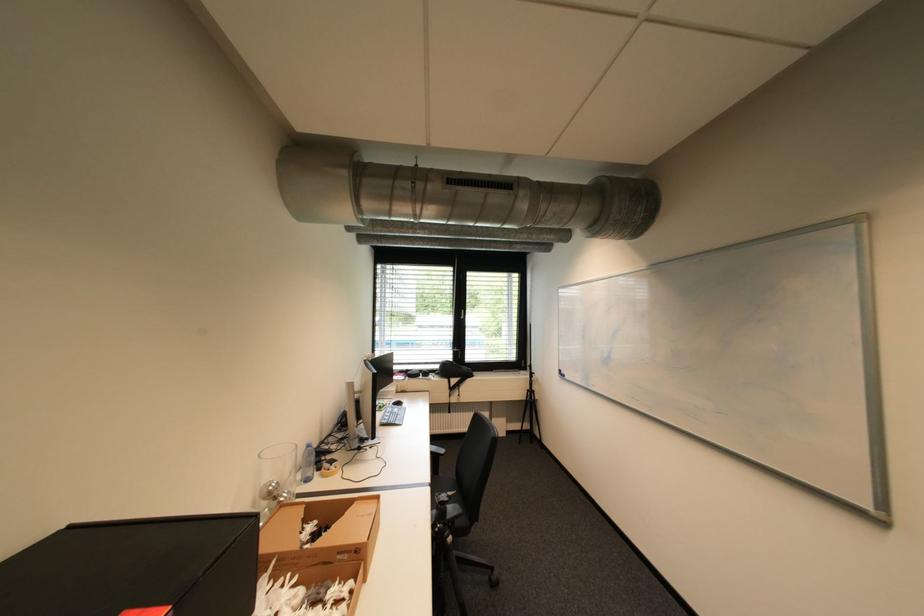
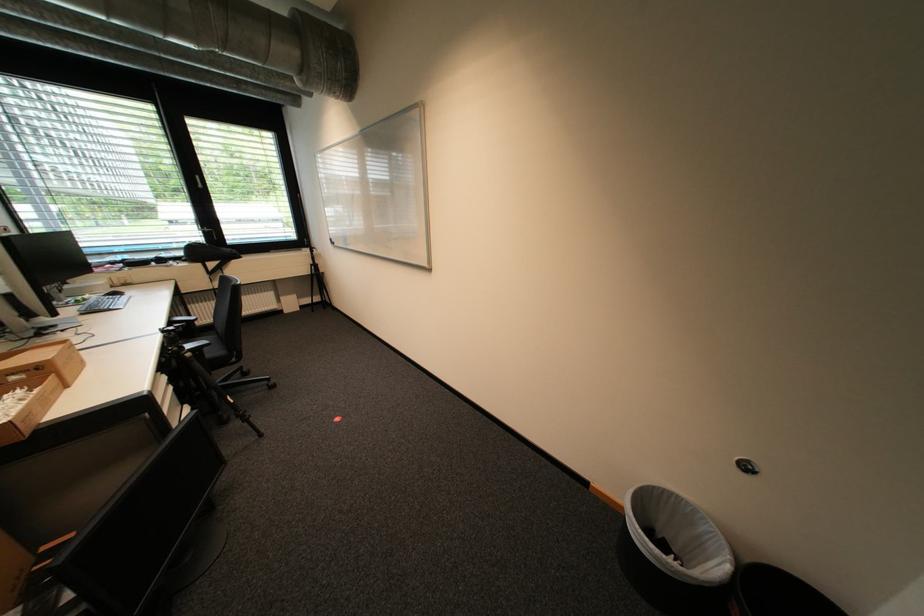
The point at (456, 496) is marked in the first image. Where is the corresponding point in the second image?

(184, 328)